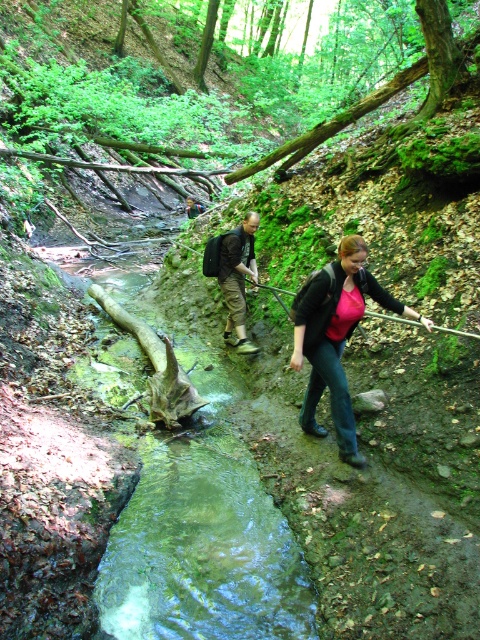
In the scene shown: Who is lower down, matte black jacket at center or dark brown leather backpack at center?

matte black jacket at center

Between point (339, 458) and point (228, 336), which one is positioned in front?

Point (339, 458)

Where is `matte black jacket at center`? The image size is (480, 640). matte black jacket at center is located at coordinates (335, 337).

You are a GUI agent. You are given a task and a screenshot of the screen. Output one action in this format:
    pyautogui.click(x=<x>, y=<y>)
    Task: Click on the matte black jacket at center
    This screenshot has height=640, width=480.
    Given the screenshot: What is the action you would take?
    pyautogui.click(x=335, y=337)